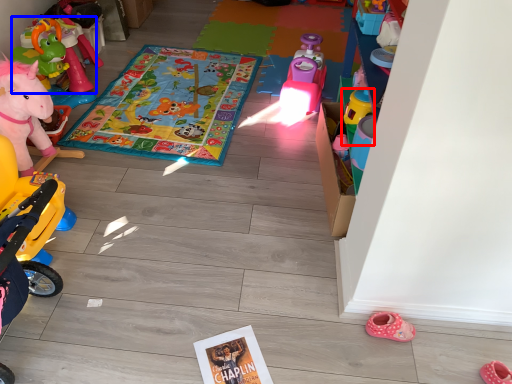
Question: Which object appears closest to the camera in this image, toy (highlighted by a red box) or toy (highlighted by a blue box)?

Choices:
 (A) toy
 (B) toy

Answer: (A)